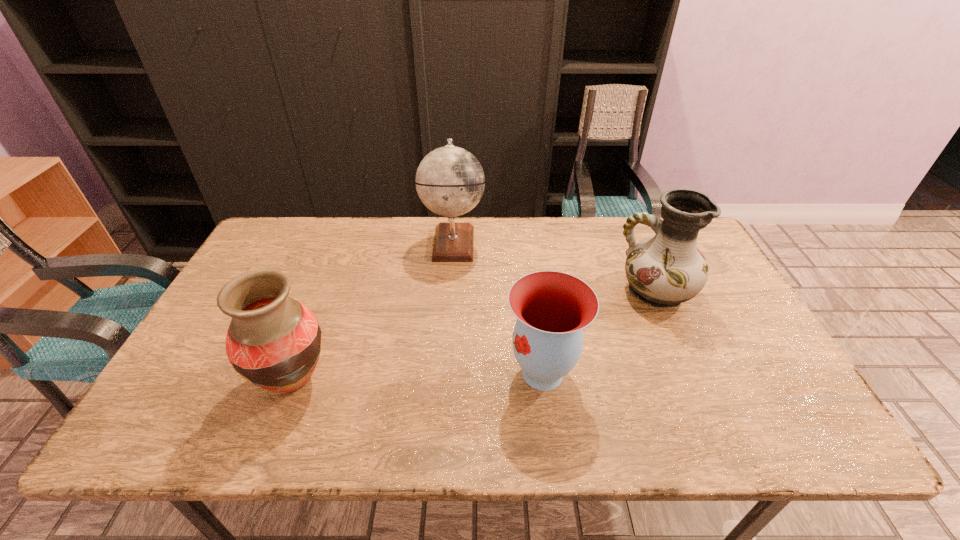
Identify the location of the third object from right to left. Image resolution: width=960 pixels, height=540 pixels. (450, 181).

The width and height of the screenshot is (960, 540). Identify the location of globe. (450, 181).

Find the location of `the farthest vase`. the farthest vase is located at coordinates (665, 270).

I want to click on the rightmost object, so click(x=665, y=270).

The height and width of the screenshot is (540, 960). What are the coordinates of `the leftmost object` in the screenshot? It's located at (273, 341).

The image size is (960, 540). In order to click on the shortest vase in this screenshot , I will do `click(552, 308)`.

The image size is (960, 540). Find the location of `the second vase from left to right`. the second vase from left to right is located at coordinates (552, 308).

Find the location of a particular element. The height and width of the screenshot is (540, 960). vacant space located at the equator of the farthest object is located at coordinates (576, 242).

The image size is (960, 540). I want to click on vacant space located 0.230m on the front of the second farthest object, so click(700, 390).

Where is `vacant space located 0.260m on the right of the leftmost object`? vacant space located 0.260m on the right of the leftmost object is located at coordinates (444, 381).